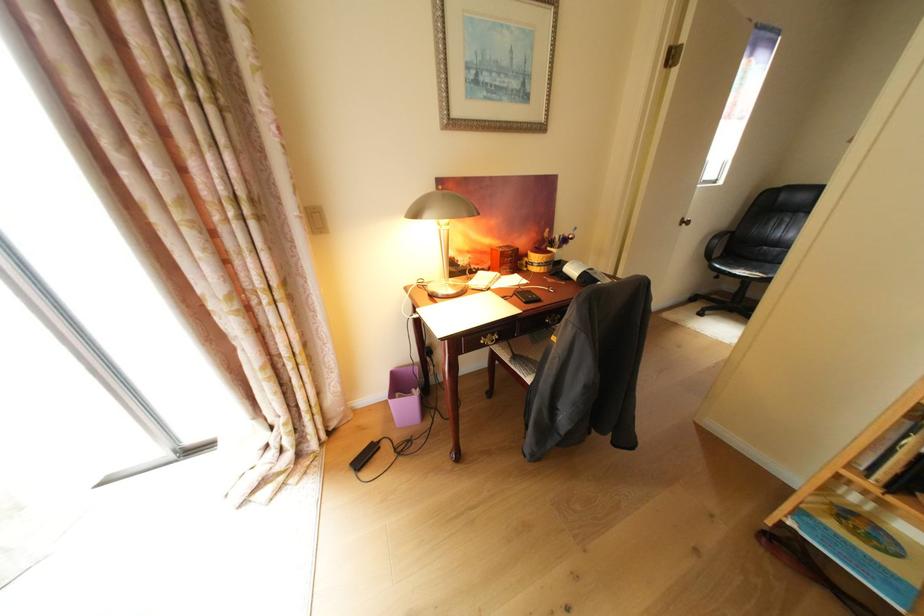
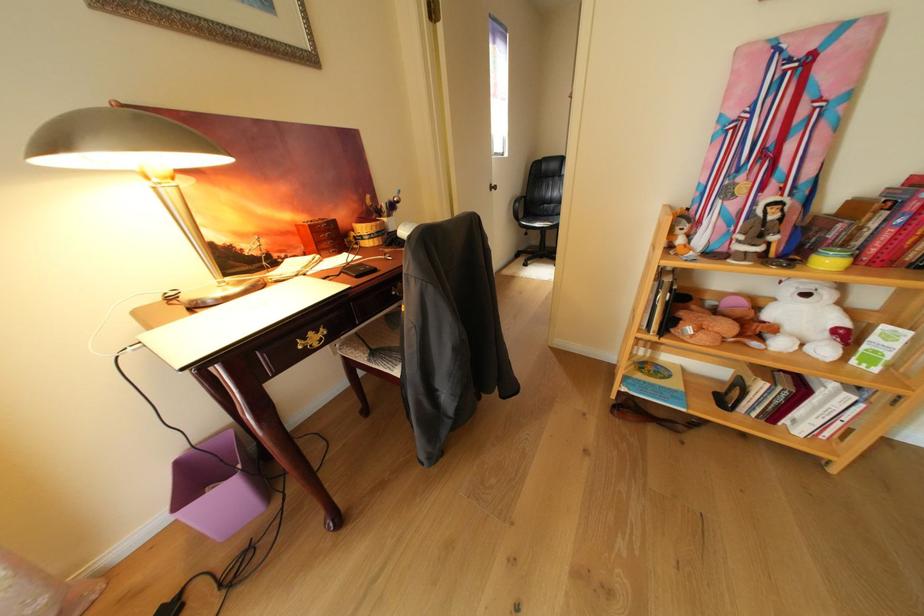
Where in the second image is the point corresponding to point 751,270 from the first image?

(550, 224)